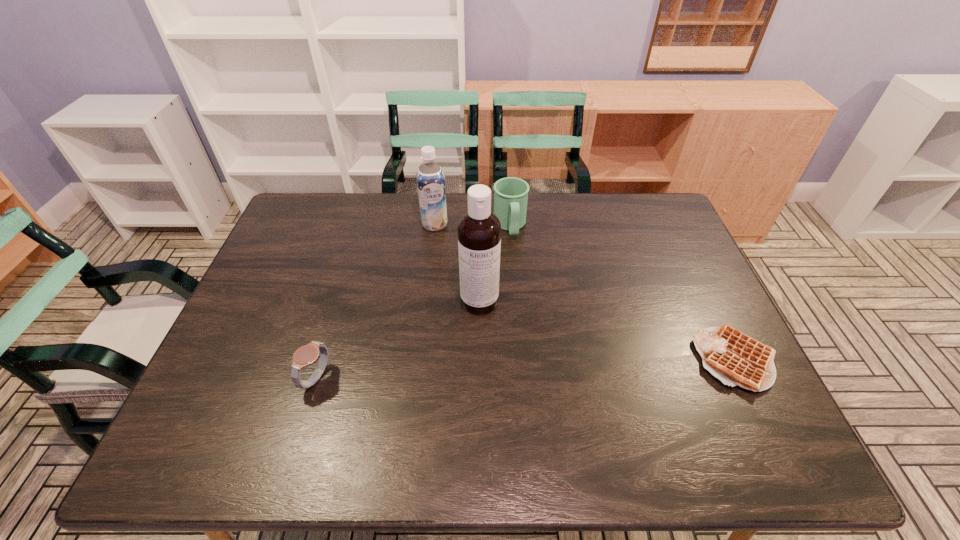
At what (x,y) coordinates should I click in order to perform the action: click on mug that is positioned at the far edge. Please return your answer as a coordinate pair (x, y). Looking at the image, I should click on click(x=510, y=194).

Where is `soya milk that is positioned at the far edge`? soya milk that is positioned at the far edge is located at coordinates (430, 178).

This screenshot has width=960, height=540. In order to click on watch positioned at the near edge in this screenshot , I will do click(306, 355).

Where is `waffle at the near edge`? waffle at the near edge is located at coordinates (734, 358).

Locate an element on the screen. The width and height of the screenshot is (960, 540). object that is at the right edge is located at coordinates (734, 358).

Find the location of a particular element. The image size is (960, 540). object at the near right corner is located at coordinates click(734, 358).

Find the location of `vacant space at the far edge of the desktop`. vacant space at the far edge of the desktop is located at coordinates coord(388,222).

I want to click on vacant position at the near edge of the desktop, so click(x=553, y=390).

Image resolution: width=960 pixels, height=540 pixels. What are the coordinates of `vacant space at the left edge` in the screenshot? It's located at (290, 237).

You are a GUI agent. You are given a task and a screenshot of the screen. Output one action in this format:
    pyautogui.click(x=<x>, y=<y>)
    Task: Click on the free space at the right edge of the desktop
    The image size is (960, 540).
    Given the screenshot: What is the action you would take?
    pyautogui.click(x=680, y=257)